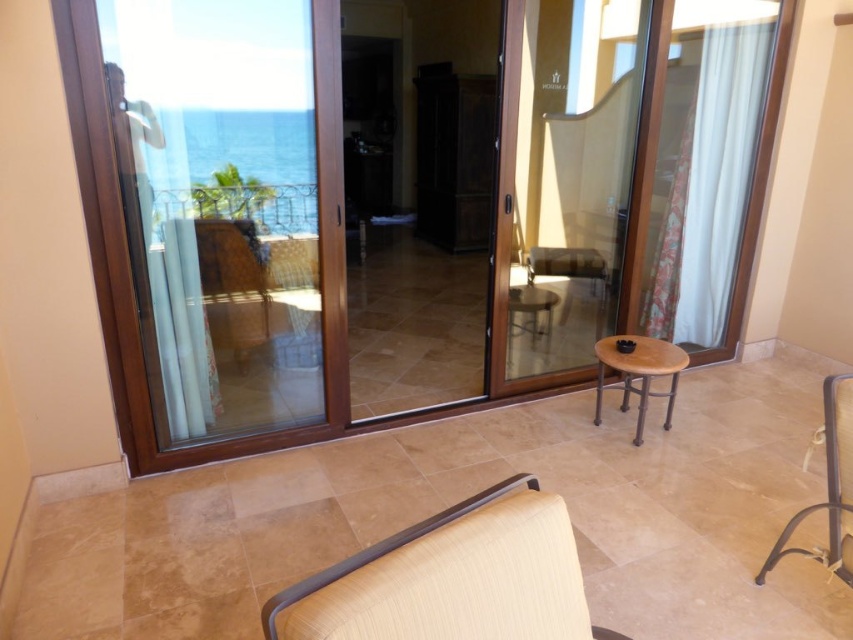
You are standing in the room and looking through the sliding glass doors. There are two points marked on the glass doors. The first point is at coordinate point [339,632] and the second is at point [653,392]. Which point is physically closer to your eyes?

Point [339,632] is closer to the camera than point [653,392], so the first point is closer to your eyes.

You are planning to place a large potted plant that requires a space of 1.2 meters in diameter. You see the beige fabric armchair at lower center and the metallic wrought iron railing at upper left. Which object can accommodate the plant based on their sizes?

The beige fabric armchair at lower center is bigger than the metallic wrought iron railing at upper left, so the beige fabric armchair at lower center can accommodate the plant as it has sufficient space.

Looking at this image, you are sitting in the beige fabric armchair at lower center and want to step onto the balcony outside the sliding doors. Based on the armchair location, can you directly reach the balcony without moving past the sliding doors?

The beige fabric armchair at lower center is located at point (451, 579), which is close to the sliding doors. Since the sliding doors are the only exit to the balcony, you can directly reach the balcony from the beige fabric armchair at lower center without needing to move past them.